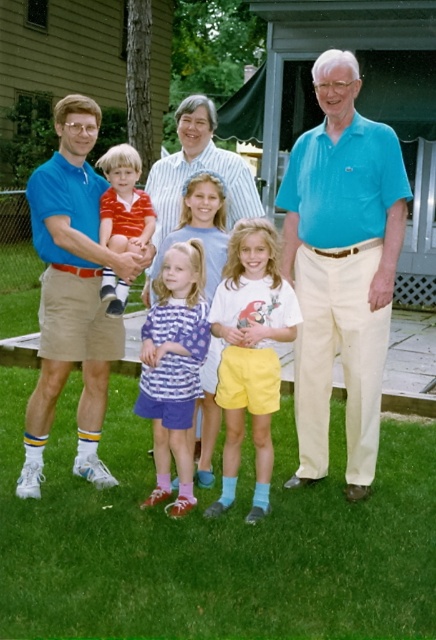
Question: Which point is farther to the camera?

Choices:
 (A) (320, 236)
 (B) (68, 218)
 (C) (125, 154)

Answer: (C)

Question: Does teal polo shirt at right appear on the left side of blue cotton polo shirt at left?

Choices:
 (A) no
 (B) yes

Answer: (A)

Question: In this image, where is teal polo shirt at right located relative to blue cotton polo shirt at left?

Choices:
 (A) right
 (B) left

Answer: (A)

Question: Is teal polo shirt at right bigger than blue cotton polo shirt at left?

Choices:
 (A) no
 (B) yes

Answer: (B)

Question: Which is farther from the striped cotton shirt at left?

Choices:
 (A) striped cotton shirt at center
 (B) yellow cotton shorts at center
 (C) matte blue shirt at center

Answer: (C)

Question: Which object is the closest to the teal polo shirt at right?

Choices:
 (A) matte blue shirt at center
 (B) blue cotton polo shirt at left
 (C) striped cotton shirt at center

Answer: (A)